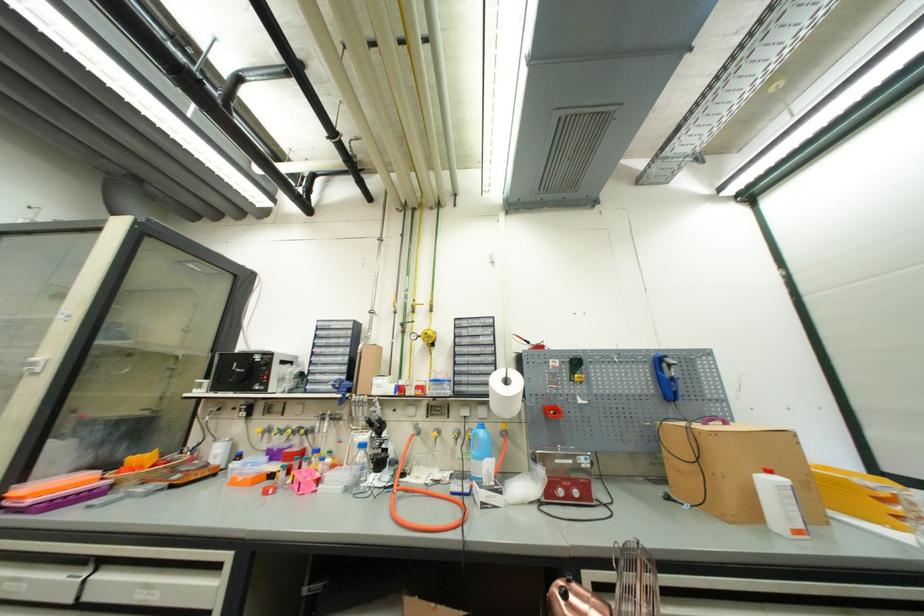
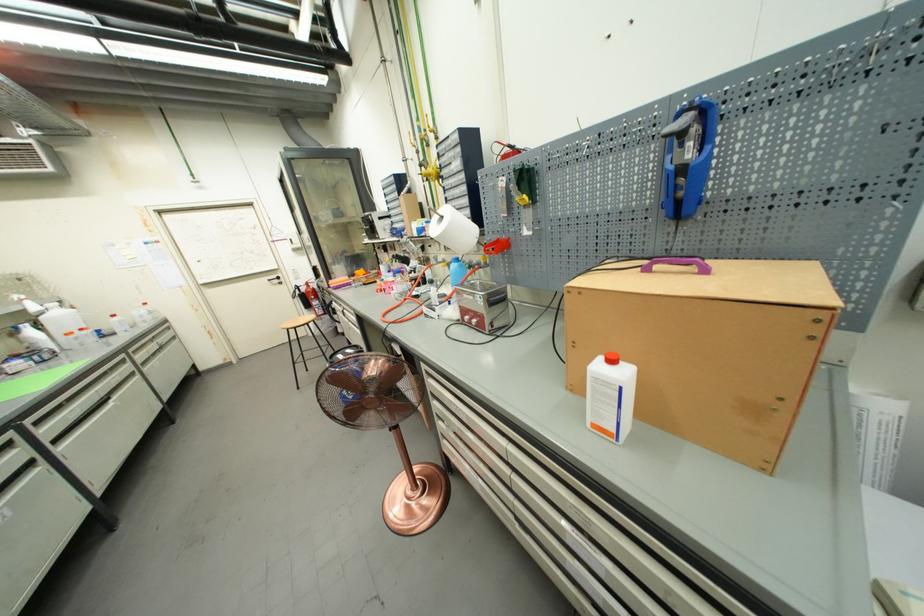
Question: I am providing you with two images of the same scene from different viewpoints. After the viewpoint changes to image2, which objects are now occluded?

Choices:
 (A) blue tool handle
 (B) purple box handle
 (C) spray bottle trigger
 (D) none of these

Answer: (D)